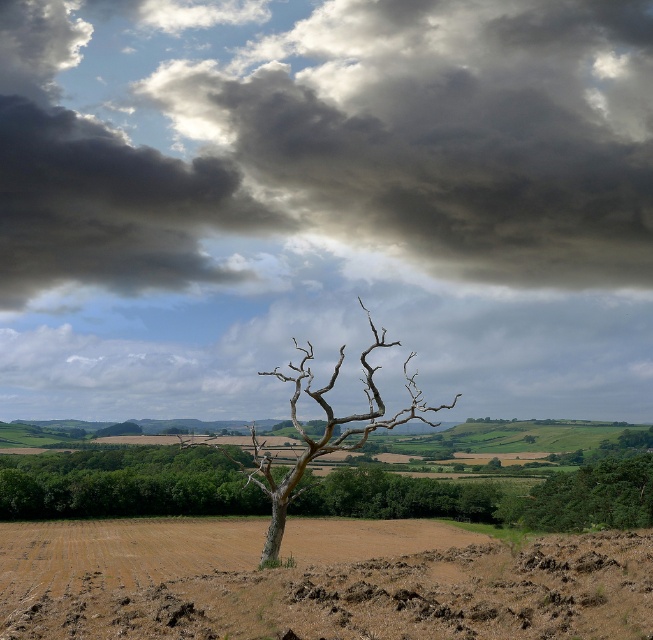
You are an astronomer trying to determine the position of the dark gray cloud at upper center in the image. What are its coordinates?

The dark gray cloud at upper center is located at coordinates point (330, 141).

You are standing in the rural landscape and want to take a photo of the brown soil at center and the green leafy tree at right. Which object will appear closer to the camera in the photo?

The brown soil at center will appear closer to the camera in the photo because it is positioned in front of the green leafy tree at right.

You are standing at the point closest to the barren tree in the foreground. There are two points marked in the image, one at coordinates point (513, 36) and another at point (377, 572). Which point is farther away from you?

Point (513, 36) is behind point (377, 572), so the point at (513, 36) is farther away from you.